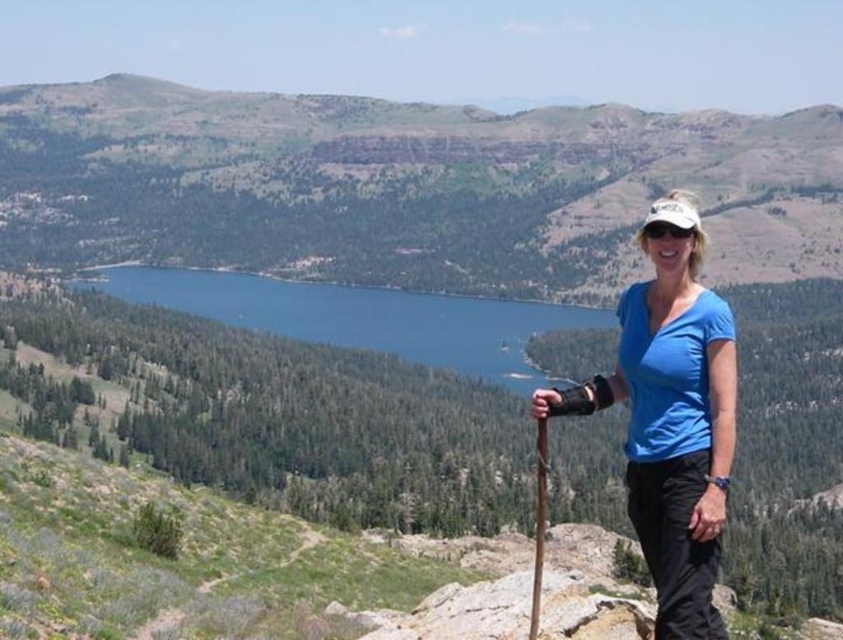
Can you confirm if green grassy mountain at center is taller than blue glassy lake at center?

Correct, green grassy mountain at center is much taller as blue glassy lake at center.

This screenshot has height=640, width=843. In order to click on green grassy mountain at center in this screenshot , I will do `click(404, 186)`.

Does point (326, 230) lie behind point (317, 333)?

Yes.

What are the coordinates of `green grassy mountain at center` in the screenshot? It's located at (x=404, y=186).

Is point (576, 237) farther from camera compared to point (667, 557)?

Yes, it is.

Who is taller, green grassy mountain at center or blue fabric shirt at right?

green grassy mountain at center

Where is `green grassy mountain at center`? The image size is (843, 640). green grassy mountain at center is located at coordinates tap(404, 186).

Is blue fabric shirt at right further to the viewer compared to blue glassy lake at center?

No, blue fabric shirt at right is in front of blue glassy lake at center.

Which is in front, point (645, 424) or point (244, 301)?

Point (645, 424) is in front.

What are the coordinates of `blue fabric shirt at right` in the screenshot? It's located at (670, 420).